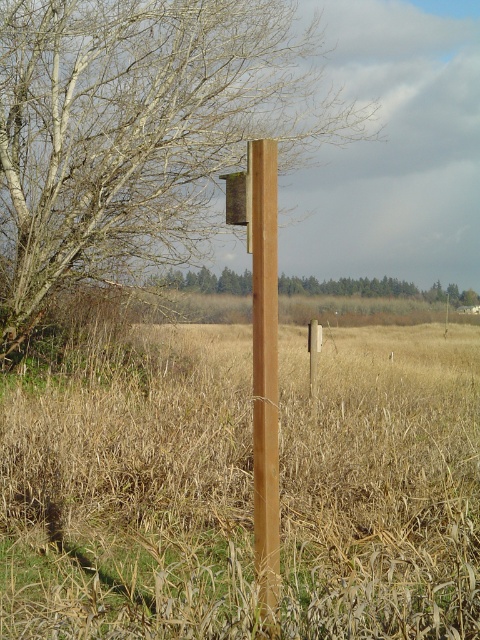
You are standing in a field and want to place a 2.5 meter long fence post between you and the dry grass at center. Is the distance sufficient to accommodate the fence post?

The distance between you and the dry grass at center is 3.24 meters, which is greater than the 2.5 meter length of the fence post. Therefore, the fence post can be placed between you and the dry grass at center.

You are a bird trying to land on the birdhouse attached to the posts. Which post should you aim for, the brown wood post at center or the smooth brown post at center?

The brown wood post at center is positioned over the smooth brown post at center, so you should aim for the brown wood post at center since it is the upper post where the birdhouse is attached.